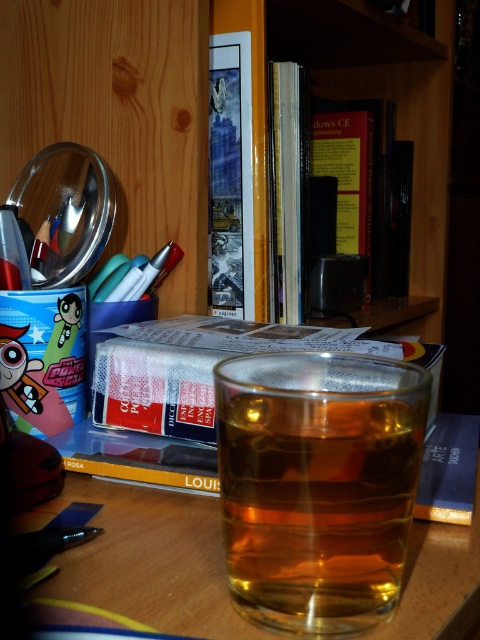
You are organizing items on a desk and need to place a new item between the transparent glass at center and the hardcover books at center. Which item should be placed closer to the edge of the desk to ensure the new item fits without overlapping both?

The transparent glass at center is not as tall as hardcover books at center, so placing the new item closer to the transparent glass at center would leave enough space between them to avoid overlapping both.

You are organizing items on your desk. You have a translucent glass at center and hardcover books at center. Which item takes up more space on the desk?

The hardcover books at center take up more space on the desk because the translucent glass at center is smaller than them.